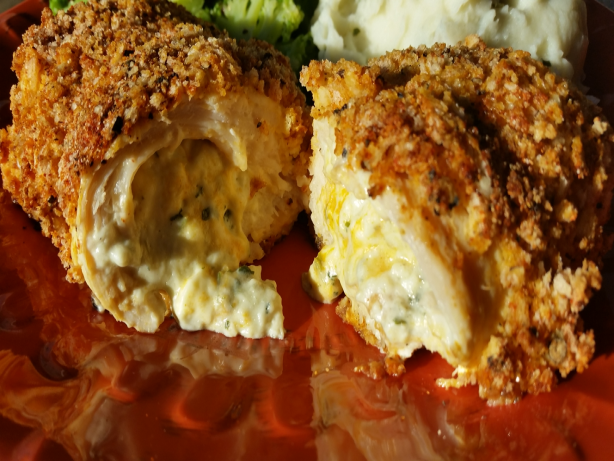
The image size is (614, 461). I want to click on plate, so click(297, 439).